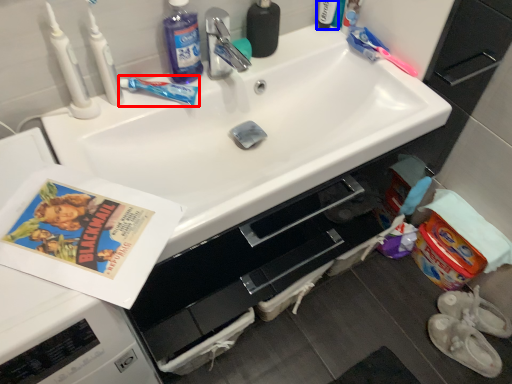
Question: Which of the following is the closest to the observer, toothbrush (highlighted by a red box) or toiletry (highlighted by a blue box)?

Choices:
 (A) toothbrush
 (B) toiletry

Answer: (A)